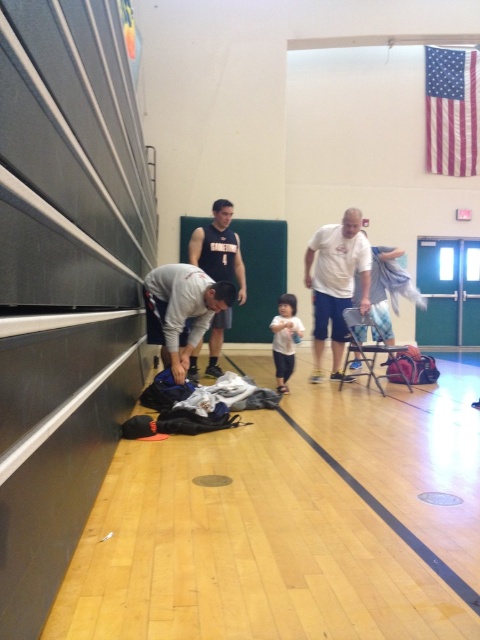
Can you confirm if white matte shirt at center is positioned below black jersey at center?

Correct, white matte shirt at center is located below black jersey at center.

Does white matte shirt at center come in front of black jersey at center?

Yes, it is.

Is point (313, 337) positioned before point (225, 275)?

Yes, it is in front of point (225, 275).

This screenshot has width=480, height=640. I want to click on white matte shirt at center, so click(x=336, y=282).

Does black jersey at center have a lesser height compared to white cotton shirt at center?

In fact, black jersey at center may be taller than white cotton shirt at center.

Between black jersey at center and white cotton shirt at center, which one is positioned higher?

black jersey at center is higher up.

Is point (216, 372) more distant than point (279, 317)?

Yes, point (216, 372) is behind point (279, 317).

Locate an element on the screen. black jersey at center is located at coordinates (218, 248).

Is white matte shirt at center thinner than white cotton shirt at center?

In fact, white matte shirt at center might be wider than white cotton shirt at center.

Does point (330, 230) come farther from viewer compared to point (292, 298)?

Yes, it is.

Who is more forward, (x=338, y=362) or (x=280, y=332)?

Point (x=280, y=332)

Where is `white matte shirt at center`? The width and height of the screenshot is (480, 640). white matte shirt at center is located at coordinates (336, 282).